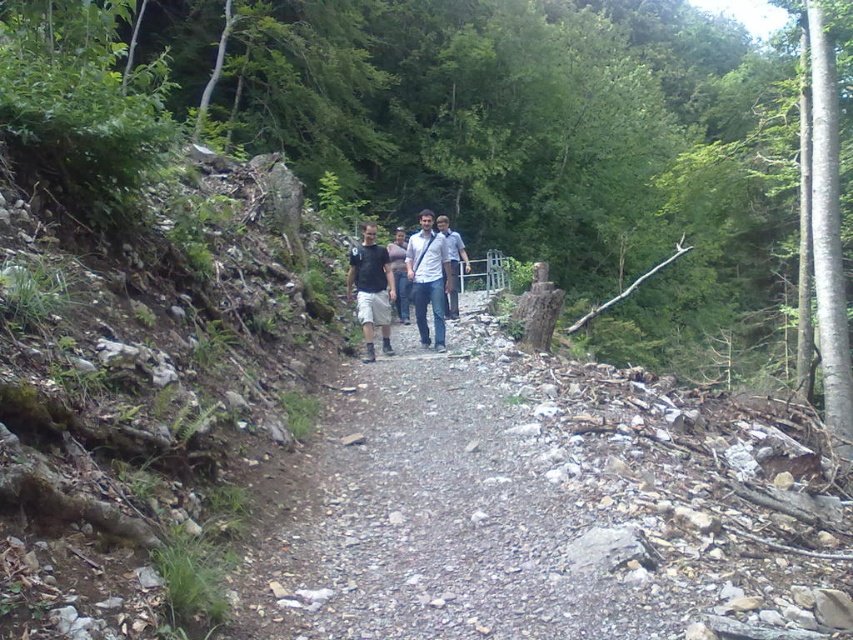
Question: Which object appears closest to the camera in this image?

Choices:
 (A) matte black t-shirt at center
 (B) white matte shirt at center
 (C) dark gray fabric shirt at center

Answer: (A)

Question: From the image, what is the correct spatial relationship of matte black t-shirt at center in relation to white matte shirt at center?

Choices:
 (A) above
 (B) below

Answer: (B)

Question: Observing the image, what is the correct spatial positioning of dark gray fabric shirt at center in reference to white matte shirt at center?

Choices:
 (A) above
 (B) below

Answer: (B)

Question: Which point is closer to the camera?

Choices:
 (A) 364,282
 (B) 444,259

Answer: (A)

Question: Is dark gray fabric shirt at center positioned before matte black t-shirt at center?

Choices:
 (A) yes
 (B) no

Answer: (B)

Question: Which point is farther to the camera?

Choices:
 (A) matte black t-shirt at center
 (B) white matte shirt at center
 (C) dark gray fabric shirt at center

Answer: (B)